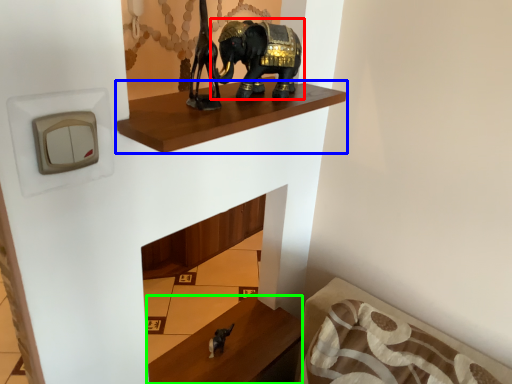
Question: Which object is positioned closest to elephant (highlighted by a red box)? Select from shelf (highlighted by a blue box) and furniture (highlighted by a green box).

Choices:
 (A) shelf
 (B) furniture

Answer: (A)